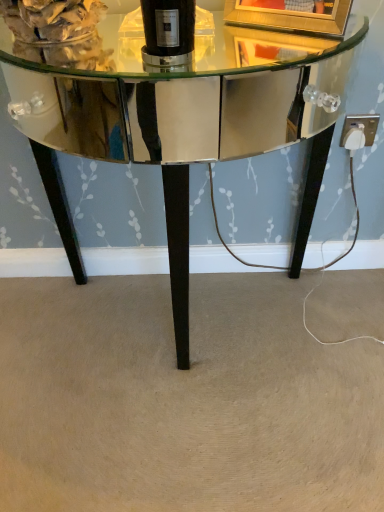
Question: Is shiny mirrored table at center next to black glass bottle at center?

Choices:
 (A) yes
 (B) no

Answer: (B)

Question: Can you confirm if shiny mirrored table at center is wider than black glass bottle at center?

Choices:
 (A) no
 (B) yes

Answer: (B)

Question: Can black glass bottle at center be found inside shiny mirrored table at center?

Choices:
 (A) yes
 (B) no

Answer: (B)

Question: Can you confirm if shiny mirrored table at center is positioned to the left of black glass bottle at center?

Choices:
 (A) yes
 (B) no

Answer: (A)

Question: From a real-world perspective, is shiny mirrored table at center over black glass bottle at center?

Choices:
 (A) no
 (B) yes

Answer: (A)

Question: From their relative heights in the image, would you say white plastic outlet at lower right is taller or shorter than shiny mirrored table at center?

Choices:
 (A) tall
 (B) short

Answer: (B)

Question: From a real-world perspective, is white plastic outlet at lower right positioned above or below shiny mirrored table at center?

Choices:
 (A) above
 (B) below

Answer: (A)

Question: In the image, is white plastic outlet at lower right on the left side or the right side of shiny mirrored table at center?

Choices:
 (A) left
 (B) right

Answer: (B)

Question: Is white plastic outlet at lower right wider or thinner than shiny mirrored table at center?

Choices:
 (A) thin
 (B) wide

Answer: (A)

Question: From the image's perspective, relative to black glass bottle at center, is white plastic outlet at lower right above or below?

Choices:
 (A) above
 (B) below

Answer: (B)

Question: From a real-world perspective, is white plastic outlet at lower right above or below black glass bottle at center?

Choices:
 (A) above
 (B) below

Answer: (B)

Question: Considering their positions, is white plastic outlet at lower right located in front of or behind black glass bottle at center?

Choices:
 (A) behind
 (B) front

Answer: (A)

Question: From their relative heights in the image, would you say white plastic outlet at lower right is taller or shorter than black glass bottle at center?

Choices:
 (A) short
 (B) tall

Answer: (A)

Question: Is point [x=291, y=95] closer or farther from the camera than point [x=190, y=15]?

Choices:
 (A) closer
 (B) farther

Answer: (B)

Question: From the image's perspective, is shiny mirrored table at center positioned above or below black glass bottle at center?

Choices:
 (A) below
 (B) above

Answer: (A)